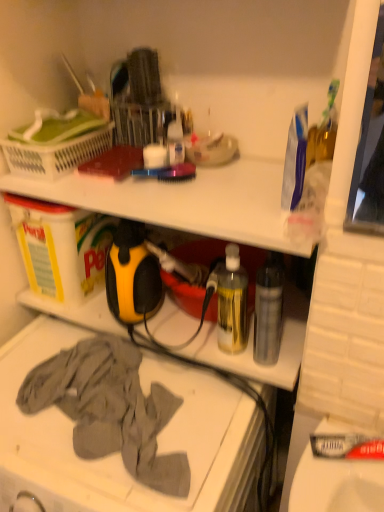
Find the location of `free location to the left of transparent plastic bottle at center-right, which ranks as the 2th bottle in left-to-right order`. free location to the left of transparent plastic bottle at center-right, which ranks as the 2th bottle in left-to-right order is located at coordinates (193, 344).